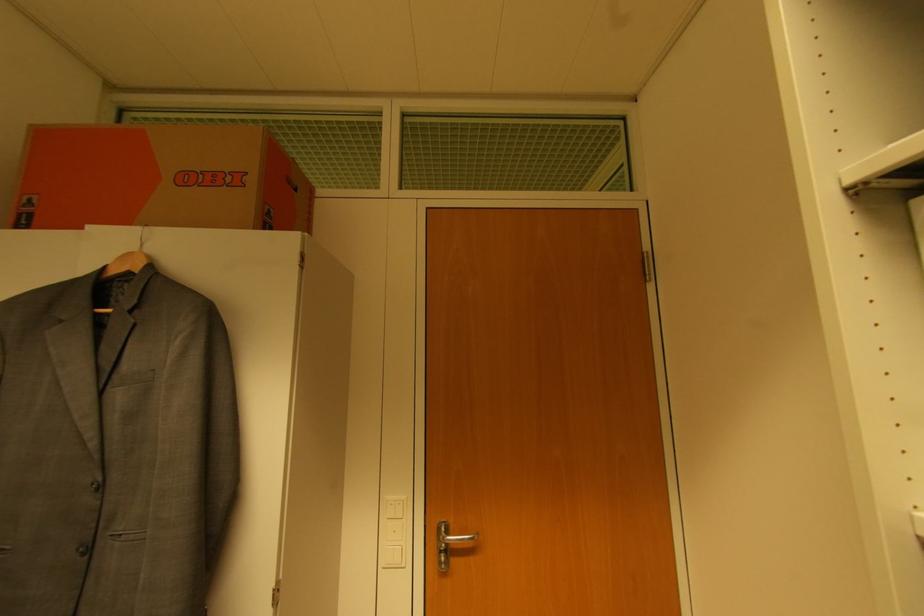
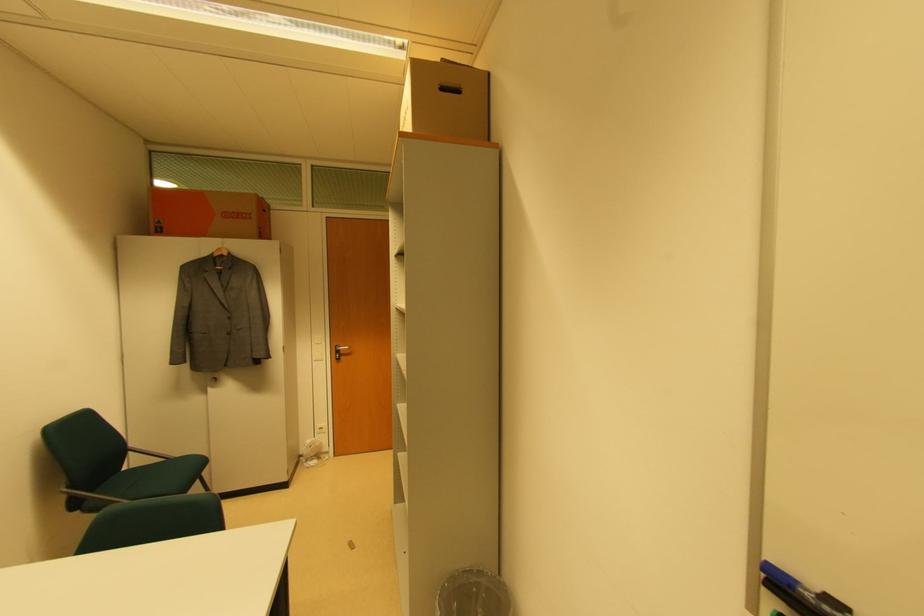
In the second image, find the point that corresponds to point 32,217 in the first image.

(163, 230)